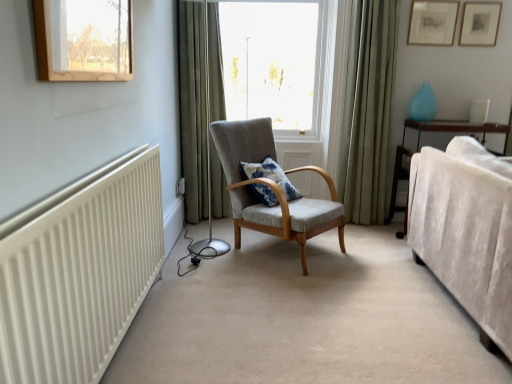
How much space does green fabric curtain at center, marked as the first curtain in a left-to-right arrangement, occupy horizontally?

green fabric curtain at center, marked as the first curtain in a left-to-right arrangement, is 23.01 centimeters wide.

Locate an element on the screen. The height and width of the screenshot is (384, 512). matte wooden picture frame at upper right, the 2th picture frame viewed from the left is located at coordinates tap(480, 23).

Find the location of a particular element. The width and height of the screenshot is (512, 384). textured gray armchair at center is located at coordinates (271, 188).

Describe the element at coordinates (368, 110) in the screenshot. I see `green fabric curtain at right, the first curtain positioned from the right` at that location.

Find the location of a particular element. The width and height of the screenshot is (512, 384). green fabric curtain at center, placed as the second curtain when sorted from right to left is located at coordinates (193, 108).

In the scene shown: From a real-world perspective, does green fabric curtain at center, placed as the second curtain when sorted from right to left, stand above textured gray armchair at center?

Yes, from a real-world perspective, green fabric curtain at center, placed as the second curtain when sorted from right to left, is over textured gray armchair at center

Does point (190, 75) come behind point (305, 236)?

Yes.

Could textured gray armchair at center be considered to be inside green fabric curtain at center, marked as the first curtain in a left-to-right arrangement?

No.

Between green fabric curtain at center, marked as the first curtain in a left-to-right arrangement, and textured gray armchair at center, which one has more height?

With more height is green fabric curtain at center, marked as the first curtain in a left-to-right arrangement.

What's the angular difference between blue printed cushion at center and matte gold picture frame at upper right, marked as the first picture frame in a left-to-right arrangement,'s facing directions?

53.8 degrees separate the facing orientations of blue printed cushion at center and matte gold picture frame at upper right, marked as the first picture frame in a left-to-right arrangement.

Consider the image. From a real-world perspective, which object stands above the other?

matte gold picture frame at upper right, which is the 2th picture frame from right to left.

Is blue printed cushion at center not near matte gold picture frame at upper right, which is the 2th picture frame from right to left?

Yes, blue printed cushion at center is far from matte gold picture frame at upper right, which is the 2th picture frame from right to left.

Is blue printed cushion at center bigger than matte gold picture frame at upper right, marked as the first picture frame in a left-to-right arrangement?

Indeed, blue printed cushion at center has a larger size compared to matte gold picture frame at upper right, marked as the first picture frame in a left-to-right arrangement.

Which is closer to the camera, (241, 218) or (497, 2)?

Point (241, 218)

Is textured gray armchair at center to the right of matte wooden picture frame at upper right, the 2th picture frame viewed from the left, from the viewer's perspective?

No.

How different are the orientations of textured gray armchair at center and matte wooden picture frame at upper right, the 1th picture frame when ordered from right to left, in degrees?

The angular difference between textured gray armchair at center and matte wooden picture frame at upper right, the 1th picture frame when ordered from right to left, is 51 degrees.

Is textured gray armchair at center positioned behind matte wooden picture frame at upper right, the 1th picture frame when ordered from right to left?

No, the depth of textured gray armchair at center is less than that of matte wooden picture frame at upper right, the 1th picture frame when ordered from right to left.

Who is shorter, blue printed cushion at center or green fabric curtain at right, the first curtain positioned from the right?

With less height is blue printed cushion at center.

From a real-world perspective, is blue printed cushion at center physically above green fabric curtain at right, which is the 2th curtain in left-to-right order?

No, from a real-world perspective, blue printed cushion at center is not on top of green fabric curtain at right, which is the 2th curtain in left-to-right order.

Is blue printed cushion at center next to green fabric curtain at right, which is the 2th curtain in left-to-right order, and touching it?

No.

Is velvet beige couch at right situated inside matte wooden picture frame at upper right, the 2th picture frame viewed from the left, or outside?

velvet beige couch at right is outside matte wooden picture frame at upper right, the 2th picture frame viewed from the left.

Is velvet beige couch at right to the right of matte wooden picture frame at upper right, the 2th picture frame viewed from the left, from the viewer's perspective?

Incorrect, velvet beige couch at right is not on the right side of matte wooden picture frame at upper right, the 2th picture frame viewed from the left.

How different are the orientations of velvet beige couch at right and matte wooden picture frame at upper right, the 1th picture frame when ordered from right to left, in degrees?

The angular difference between velvet beige couch at right and matte wooden picture frame at upper right, the 1th picture frame when ordered from right to left, is 93.1 degrees.

Is green fabric curtain at right, which is the 2th curtain in left-to-right order, in front of transparent glass window at center?

Yes, green fabric curtain at right, which is the 2th curtain in left-to-right order, is in front of transparent glass window at center.

Can you tell me how much green fabric curtain at right, which is the 2th curtain in left-to-right order, and transparent glass window at center differ in facing direction?

green fabric curtain at right, which is the 2th curtain in left-to-right order, and transparent glass window at center are facing 0.0177 degrees away from each other.

I want to click on window lying on the left of green fabric curtain at right, which is the 2th curtain in left-to-right order, so click(279, 63).

Is blue printed cushion at center taller than textured gray armchair at center?

No.

You are a GUI agent. You are given a task and a screenshot of the screen. Output one action in this format:
    pyautogui.click(x=<x>, y=<y>)
    Task: Click on the pillow above the textured gray armchair at center (from the image's perspective)
    
    Given the screenshot: What is the action you would take?
    270,175

Is point (242, 164) behind point (324, 227)?

That is True.

From a real-world perspective, is blue printed cushion at center above or below textured gray armchair at center?

From a real-world perspective, blue printed cushion at center is physically below textured gray armchair at center.

What are the coordinates of `curtain to the left of textured gray armchair at center` in the screenshot? It's located at (193, 108).

Find the location of a particular element. The height and width of the screenshot is (384, 512). the 1st picture frame counting from the right of the blue printed cushion at center is located at coordinates (432, 22).

When comparing their distances from green fabric curtain at right, the first curtain positioned from the right, does transparent glass window at center or matte wooden picture frame at upper right, the 1th picture frame when ordered from right to left, seem closer?

transparent glass window at center is closer to green fabric curtain at right, the first curtain positioned from the right.

Considering their positions, is green fabric curtain at right, the first curtain positioned from the right, positioned closer to transparent glass window at center than textured gray armchair at center?

Among the two, green fabric curtain at right, the first curtain positioned from the right, is located nearer to transparent glass window at center.

Looking at the image, which one is located further to velvet beige couch at right, textured gray armchair at center or blue printed cushion at center?

Based on the image, blue printed cushion at center appears to be further to velvet beige couch at right.

Which object lies nearer to the anchor point velvet beige couch at right, matte gold picture frame at upper right, marked as the first picture frame in a left-to-right arrangement, or green fabric curtain at center, marked as the first curtain in a left-to-right arrangement?

matte gold picture frame at upper right, marked as the first picture frame in a left-to-right arrangement, lies closer to velvet beige couch at right than the other object.

Which object lies further to the anchor point matte gold picture frame at upper right, which is the 2th picture frame from right to left, velvet beige couch at right or textured gray armchair at center?

textured gray armchair at center lies further to matte gold picture frame at upper right, which is the 2th picture frame from right to left, than the other object.

Considering their positions, is matte wooden picture frame at upper right, the 1th picture frame when ordered from right to left, positioned closer to green fabric curtain at right, the first curtain positioned from the right, than transparent glass window at center?

transparent glass window at center lies closer to green fabric curtain at right, the first curtain positioned from the right, than the other object.

Looking at the image, which one is located closer to textured gray armchair at center, green fabric curtain at center, placed as the second curtain when sorted from right to left, or blue printed cushion at center?

blue printed cushion at center lies closer to textured gray armchair at center than the other object.

Looking at the image, which one is located further to green fabric curtain at right, the first curtain positioned from the right, velvet beige couch at right or matte gold picture frame at upper right, which is the 2th picture frame from right to left?

velvet beige couch at right is positioned further to the anchor green fabric curtain at right, the first curtain positioned from the right.

I want to click on picture frame between green fabric curtain at center, placed as the second curtain when sorted from right to left, and matte wooden picture frame at upper right, the 2th picture frame viewed from the left, so click(432, 22).

Find the location of `curtain between textured gray armchair at center and matte wooden picture frame at upper right, the 2th picture frame viewed from the left`. curtain between textured gray armchair at center and matte wooden picture frame at upper right, the 2th picture frame viewed from the left is located at coordinates (368, 110).

This screenshot has width=512, height=384. I want to click on curtain situated between green fabric curtain at center, marked as the first curtain in a left-to-right arrangement, and matte wooden picture frame at upper right, the 2th picture frame viewed from the left, from left to right, so click(368, 110).

Identify the location of picture frame between textured gray armchair at center and matte wooden picture frame at upper right, the 2th picture frame viewed from the left. (432, 22).